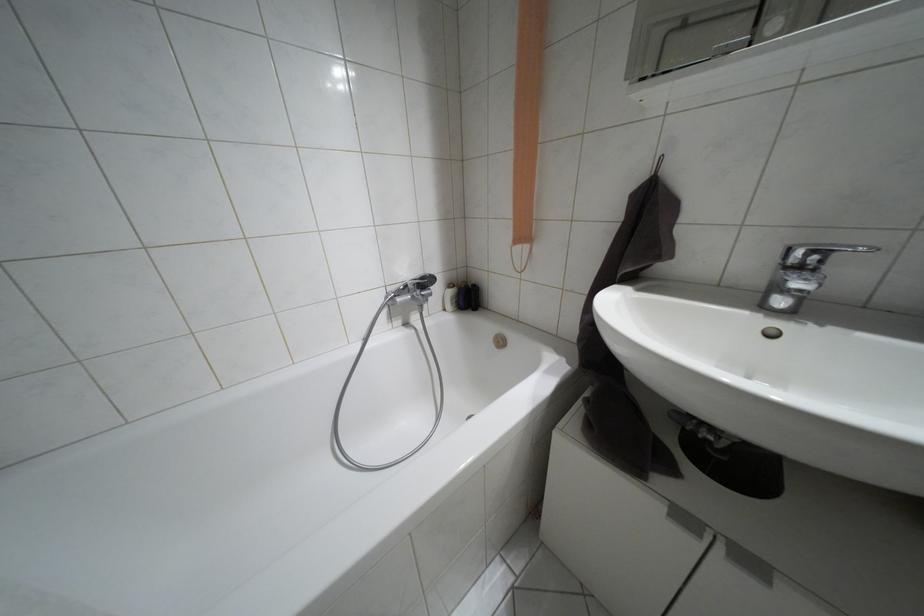
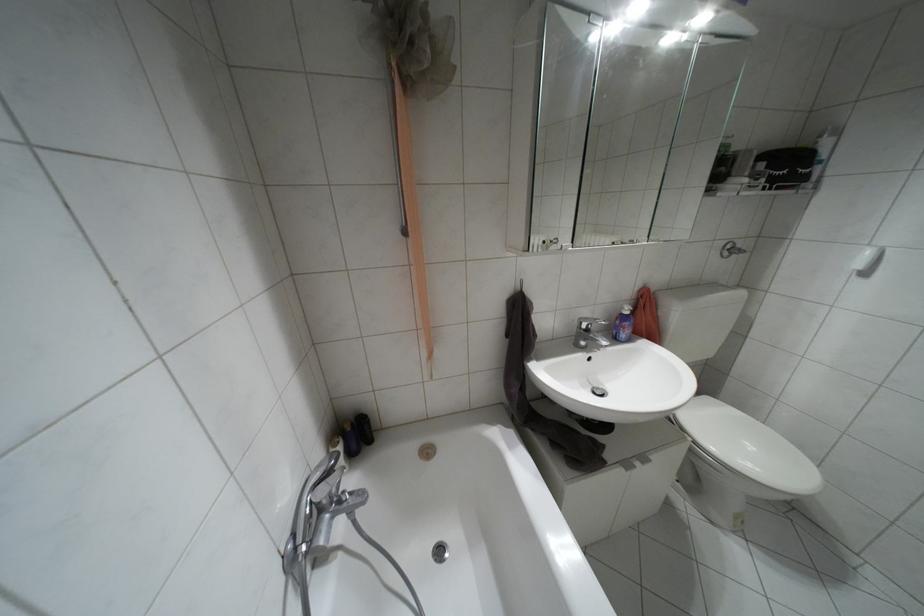
Locate, in the second image, the point that corresponds to the point at 797,269 in the first image.

(587, 330)